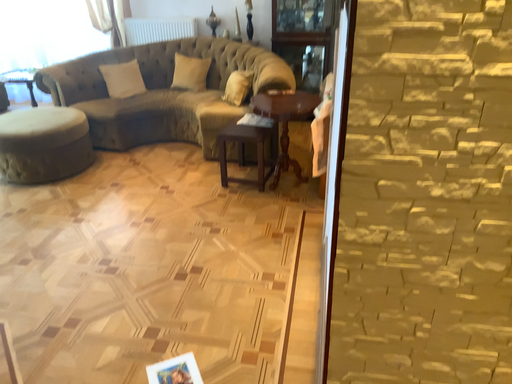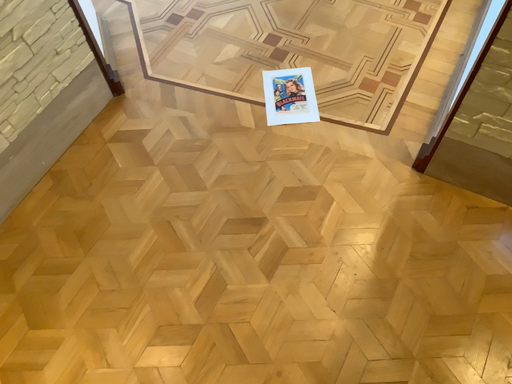
Question: How did the camera likely rotate when shooting the video?

Choices:
 (A) rotated upward
 (B) rotated downward

Answer: (B)